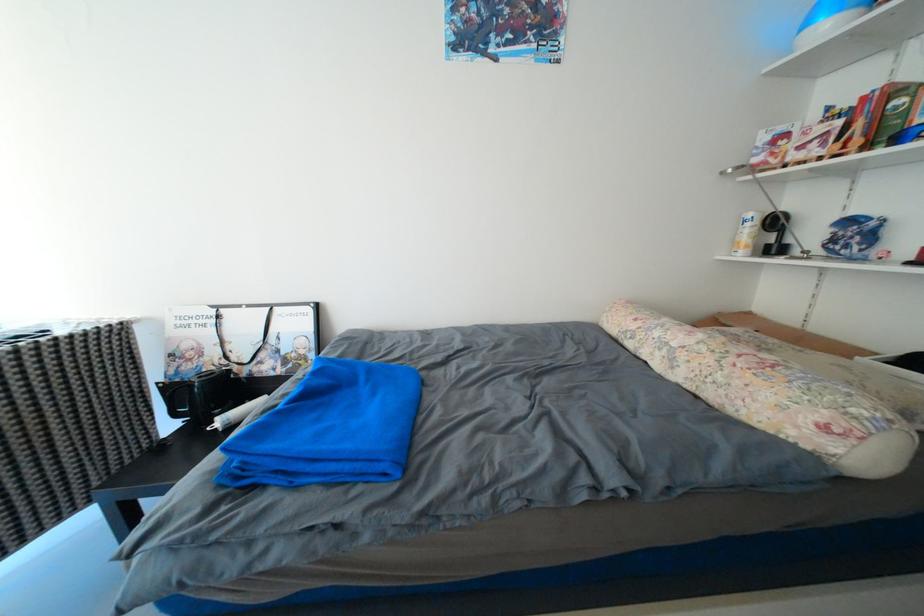
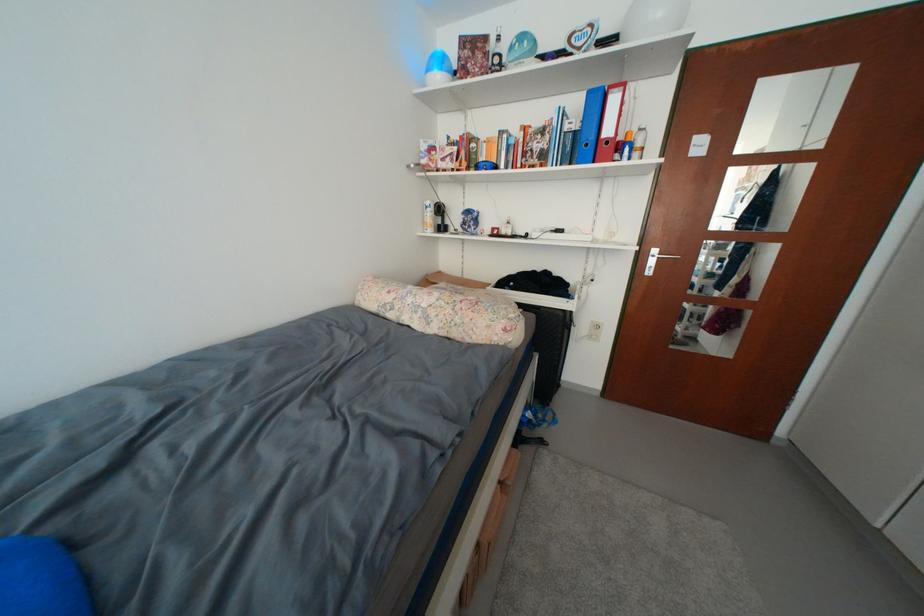
Question: Based on the continuous images, in which direction is the camera rotating? Reply with the corresponding letter.

Choices:
 (A) Left
 (B) Right
 (C) Up
 (D) Down

Answer: (B)